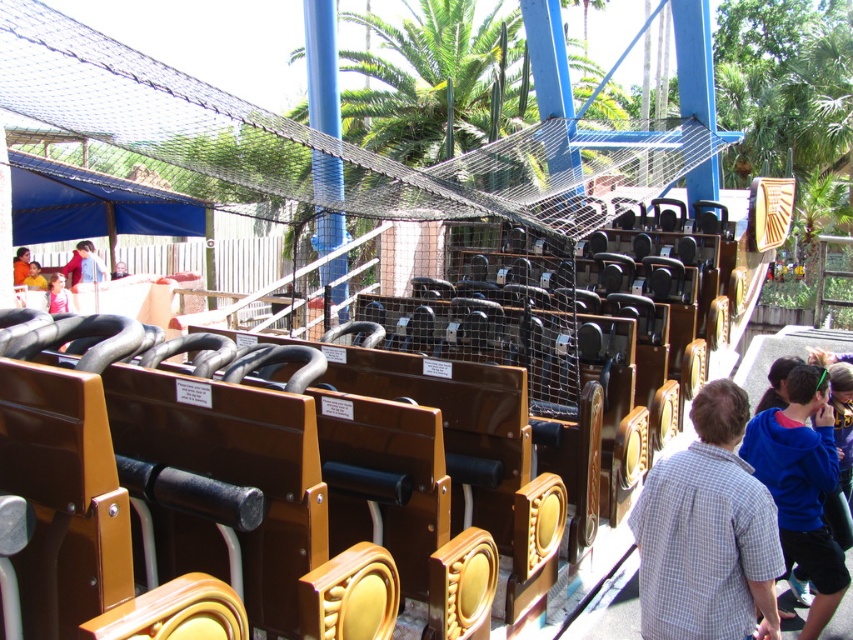
You are a park attendant checking the roller coaster seats. You notice two items left behind by passengers. The white checkered shirt at center and the blue denim jacket at left. Which item is closer to the netting structure above the tracks?

The white checkered shirt at center is taller than the blue denim jacket at left, so the white checkered shirt at center is closer to the netting structure above the tracks since it is positioned higher.

You are a park safety inspector checking the distance between the blue fleece jacket at lower right and the yellow shirt at lower left. According to the safety guidelines, the minimum distance between any two unsecured items should be at least 15 meters to prevent them from colliding during ride operations. Is the current distance compliant with the guidelines?

The blue fleece jacket at lower right and the yellow shirt at lower left are 13.48 meters apart from each other, which is less than the required 15 meters. Therefore, the current distance does not comply with the safety guidelines.

You are a park safety inspector checking the roller coaster station. You notice an object at the lower right corner of the scene. According to the coordinates provided, is the blue fleece jacket at lower right positioned closer to the roller coaster seats or the safety netting above the tracks?

The blue fleece jacket at lower right is positioned closer to the roller coaster seats because its coordinates are at point (802, 484), which places it near the lower part of the scene compared to the safety netting above the tracks.